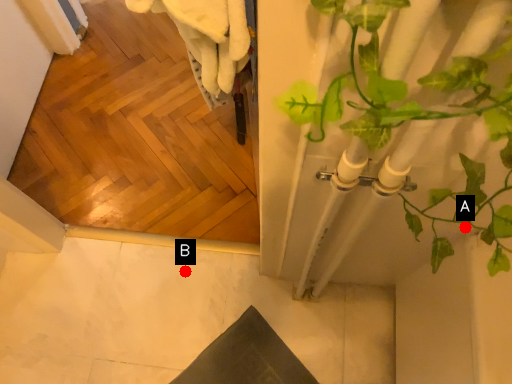
Question: Two points are circled on the image, labeled by A and B beside each circle. Which point is farther from the camera taking this photo?

Choices:
 (A) A is further
 (B) B is further

Answer: (B)